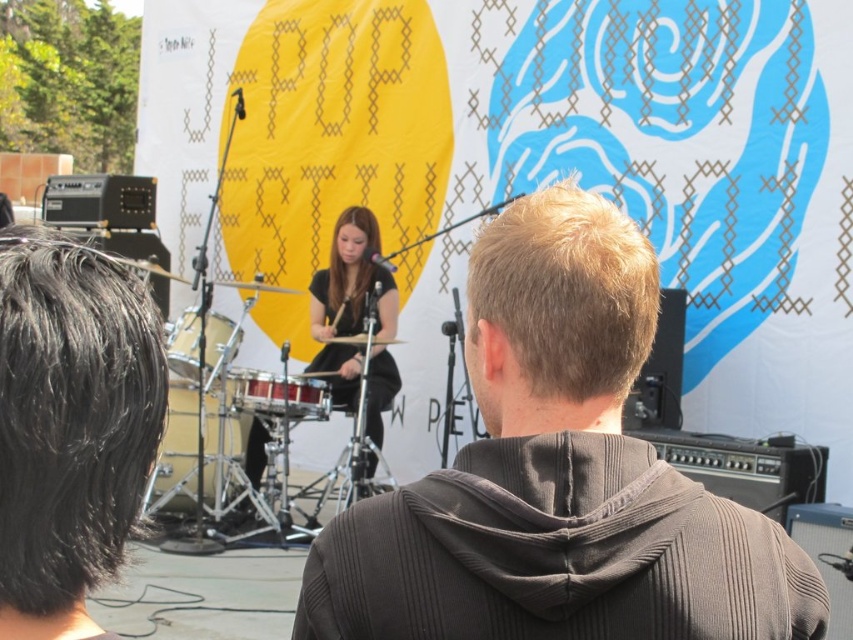
Can you confirm if gray corduroy hoodie at center is taller than shiny red drum at center?

Indeed, gray corduroy hoodie at center has a greater height compared to shiny red drum at center.

Is point (537, 337) farther from camera compared to point (285, 387)?

No, it is not.

Find the location of a particular element. gray corduroy hoodie at center is located at coordinates (556, 476).

This screenshot has width=853, height=640. Find the location of `gray corduroy hoodie at center`. gray corduroy hoodie at center is located at coordinates (556, 476).

Can you confirm if gray corduroy hoodie at center is bigger than matte black drum set at center?

No, gray corduroy hoodie at center is not bigger than matte black drum set at center.

Is gray corduroy hoodie at center smaller than matte black drum set at center?

Correct, gray corduroy hoodie at center occupies less space than matte black drum set at center.

What do you see at coordinates (556, 476) in the screenshot? The image size is (853, 640). I see `gray corduroy hoodie at center` at bounding box center [556, 476].

The width and height of the screenshot is (853, 640). I want to click on gray corduroy hoodie at center, so coord(556,476).

Measure the distance between matte black drum set at center and camera.

matte black drum set at center and camera are 7.41 meters apart from each other.

Can you confirm if matte black drum set at center is positioned to the left of metallic silver drum at lower left?

No, matte black drum set at center is not to the left of metallic silver drum at lower left.

Who is more forward, (x=341, y=234) or (x=225, y=346)?

Point (x=225, y=346) is more forward.

The image size is (853, 640). In order to click on matte black drum set at center in this screenshot , I will do `click(352, 280)`.